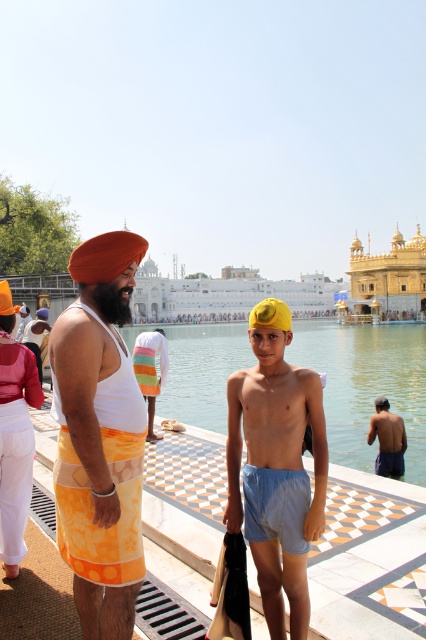
You are a visitor at the temple and want to know which turban is taller between the matte orange turban at upper left and the orange fabric turban at upper left. Can you tell me which one is taller?

The matte orange turban at upper left is taller than the orange fabric turban at upper left according to the description.

You are a photographer standing in the foreground of this religious site scene. You want to take a photo that includes both the light blue cotton shorts at lower right and the matte orange turban at upper left. Which object should you adjust your camera focus to first to ensure both are in frame?

The light blue cotton shorts at lower right is closer to you than the matte orange turban at upper left, so you should focus on the light blue cotton shorts at lower right first to ensure both are in frame.

You are a visitor at the temple and want to know which of the two headwears is narrower between the matte orange turban at center and the yellow fabric headwear at center. Which one is it?

The matte orange turban at center is thinner than the yellow fabric headwear at center, so the matte orange turban at center is narrower.